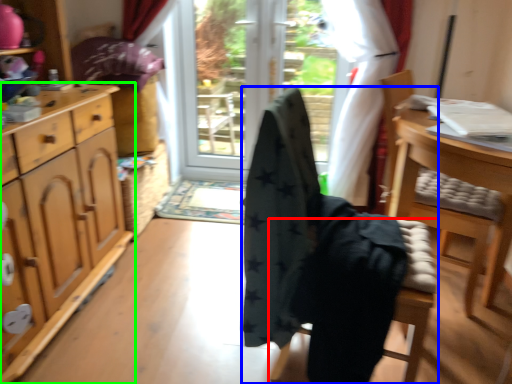
Question: Based on their relative distances, which object is nearer to chair (highlighted by a red box)? Choose from chair (highlighted by a blue box) and cabinetry (highlighted by a green box).

Choices:
 (A) chair
 (B) cabinetry

Answer: (A)